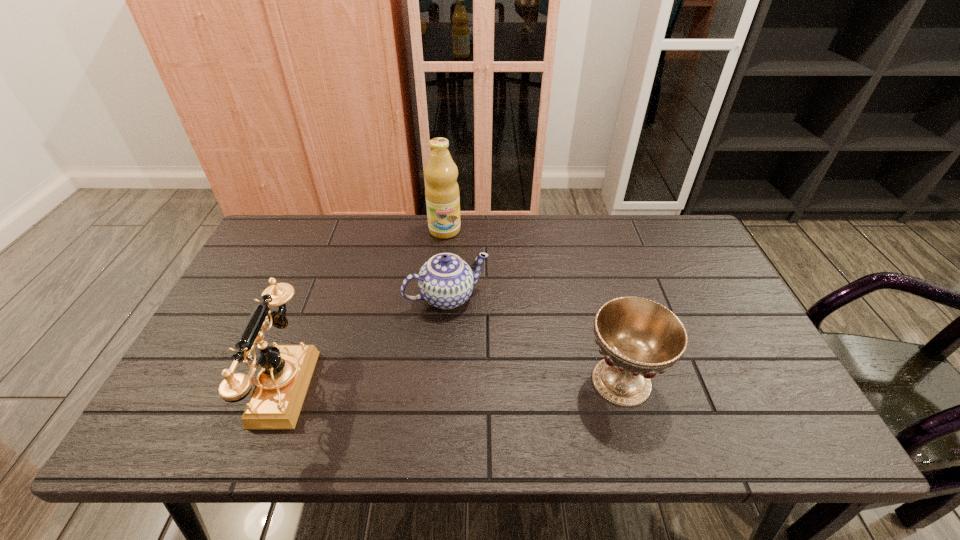
The width and height of the screenshot is (960, 540). In order to click on free spot located 0.220m on the back of the third tallest object in this screenshot , I will do `click(596, 287)`.

This screenshot has height=540, width=960. Find the location of `vacant area located 0.380m on the label of the tallest object`. vacant area located 0.380m on the label of the tallest object is located at coordinates (462, 330).

The width and height of the screenshot is (960, 540). In order to click on vacant space located 0.350m on the label of the tallest object in this screenshot , I will do `click(461, 321)`.

Identify the location of vacant space located on the label of the tallest object. (449, 254).

Image resolution: width=960 pixels, height=540 pixels. I want to click on free region located 0.260m at the spout of the chinaware, so click(x=506, y=393).

The width and height of the screenshot is (960, 540). What are the coordinates of `free space located 0.100m at the spout of the chinaware` in the screenshot? It's located at (478, 342).

Image resolution: width=960 pixels, height=540 pixels. I want to click on free location located 0.180m at the spout of the chinaware, so click(x=491, y=367).

Find the location of a particular element. The image size is (960, 540). object at the far edge is located at coordinates (442, 195).

Locate an element on the screen. This screenshot has height=540, width=960. telephone that is at the near edge is located at coordinates (282, 384).

Where is `chalice located in the near edge section of the desktop`? The width and height of the screenshot is (960, 540). chalice located in the near edge section of the desktop is located at coordinates (638, 337).